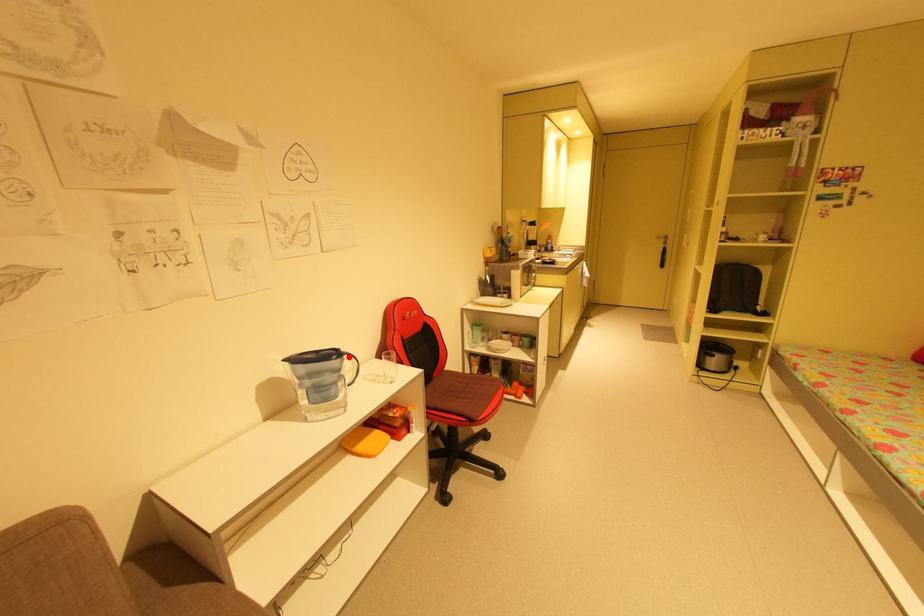
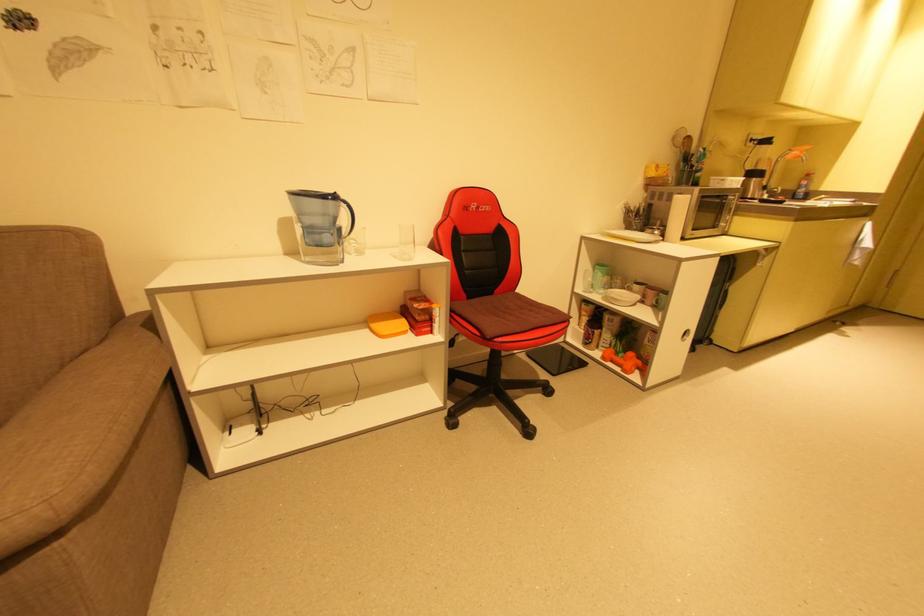
Question: I am providing you with two images of the same scene from different viewpoints. Image1 has a red point marked. In image2, the corresponding 3D location appears at what relative position? Reply with the corresponding letter.

Choices:
 (A) Closer
 (B) Farther

Answer: (B)